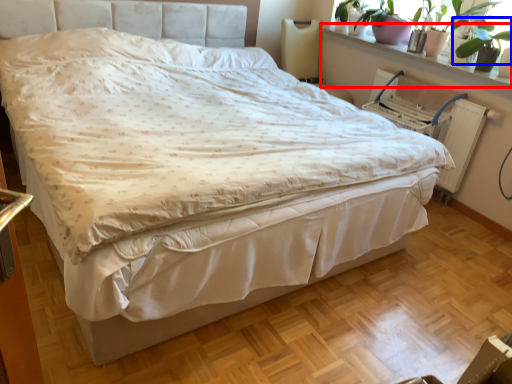
Question: Among these objects, which one is farthest to the camera, window sill (highlighted by a red box) or plant (highlighted by a blue box)?

Choices:
 (A) window sill
 (B) plant

Answer: (A)